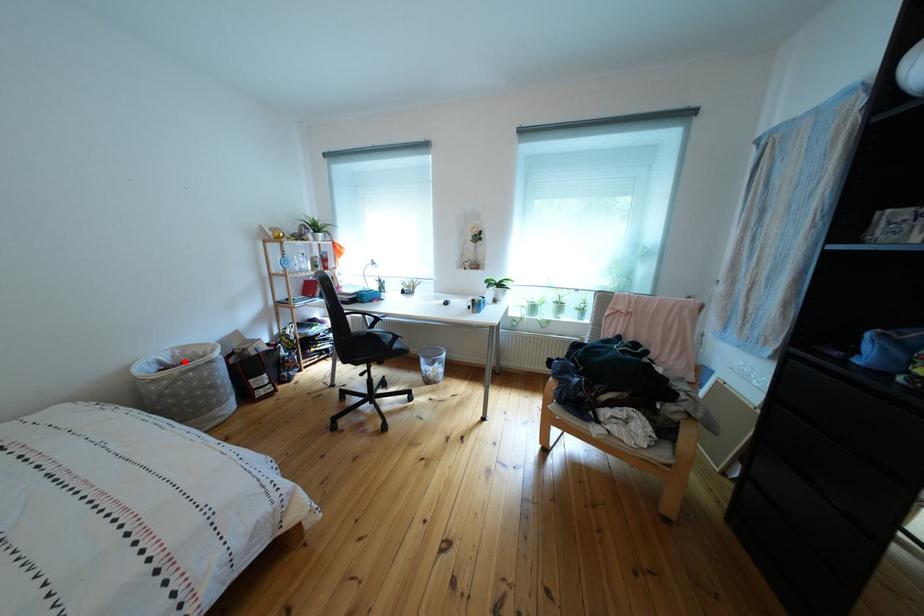
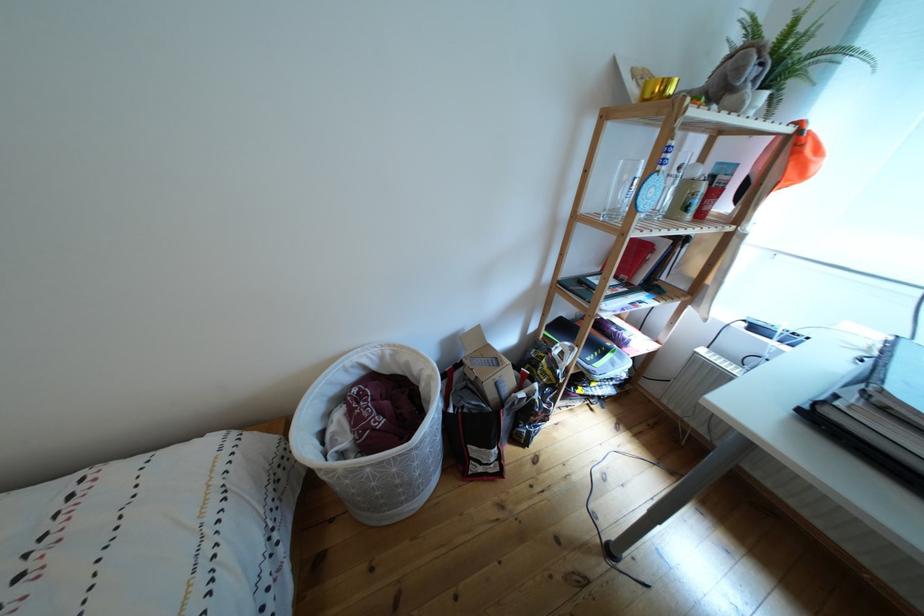
Locate, in the second image, the point that corresponds to the highlighted location in the first image.

(393, 363)